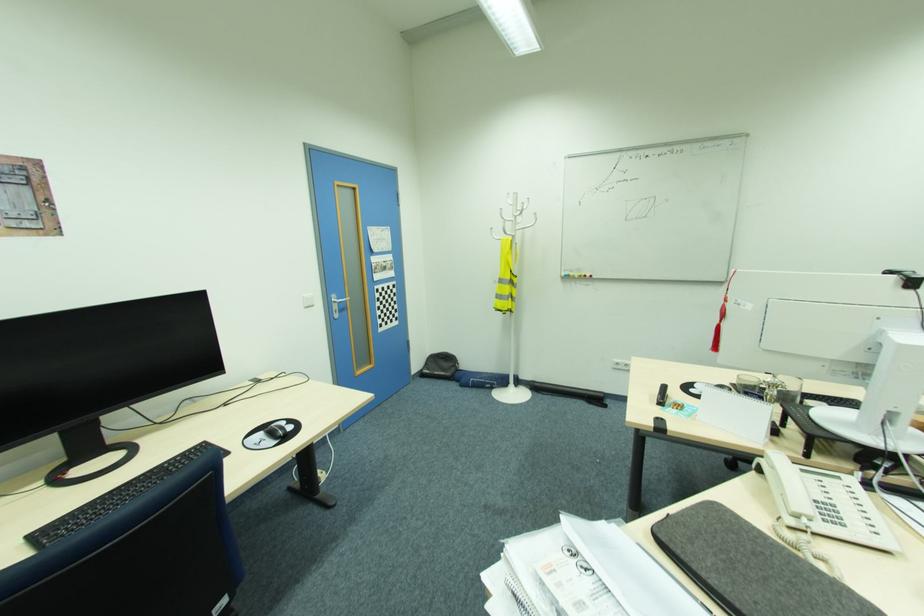
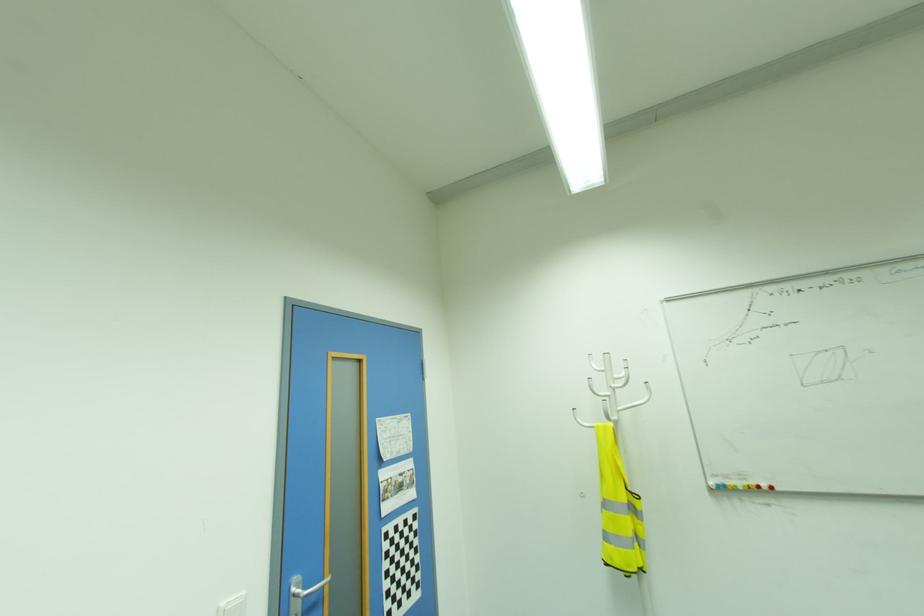
Where in the second image is the point corresponding to point (519, 229) from the first image?

(622, 408)